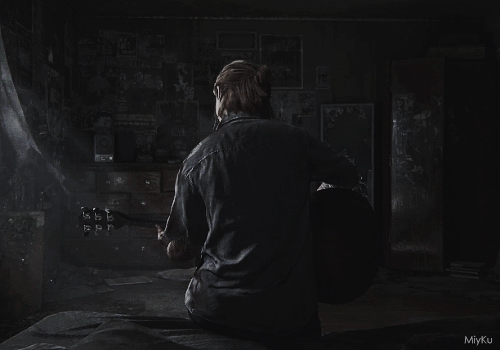
Image resolution: width=500 pixels, height=350 pixels. Identify the location of curtain. (18, 135).